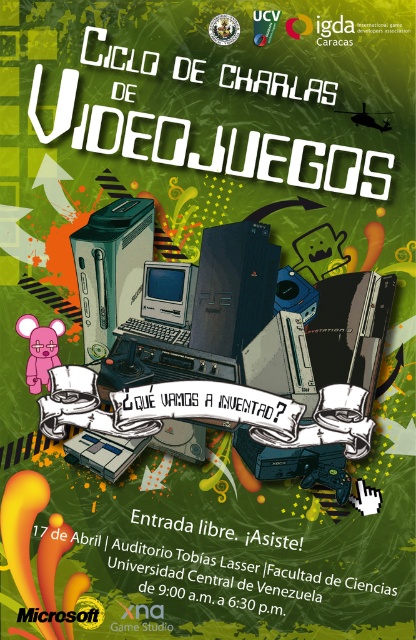
Question: Which point is closer to the camera?

Choices:
 (A) (245, 253)
 (B) (37, 369)

Answer: (B)

Question: Is satin black playstation at center positioned in front of green matte xbox at center?

Choices:
 (A) yes
 (B) no

Answer: (A)

Question: Does satin black playstation at center have a smaller size compared to matte gray computer at center?

Choices:
 (A) no
 (B) yes

Answer: (A)

Question: Which point is farther from the camera taking this photo?

Choices:
 (A) (46, 348)
 (B) (233, 241)
 (C) (185, 328)

Answer: (C)

Question: Which point appears farthest from the camera in this image?

Choices:
 (A) (47, 332)
 (B) (151, 260)
 (C) (113, 205)

Answer: (B)

Question: Does green matte xbox at center have a larger size compared to pink rubber mouse at lower left?

Choices:
 (A) no
 (B) yes

Answer: (B)